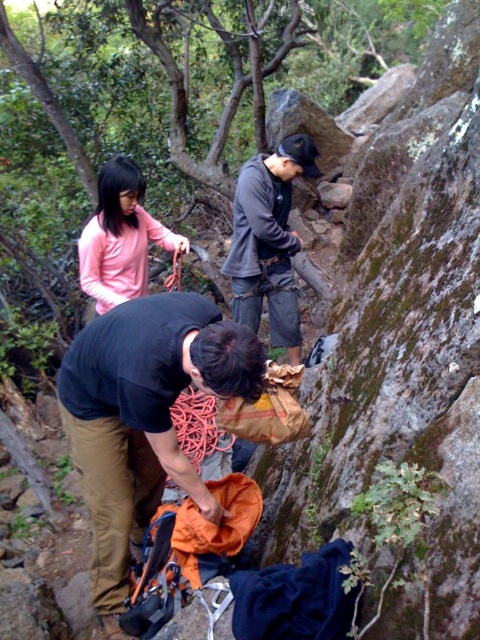
Is point (120, 561) positioned behind point (264, 227)?

That is False.

Is point (124, 464) behind point (240, 300)?

No, it is in front of (240, 300).

Where is `black fabric backpack at center`? Image resolution: width=480 pixels, height=640 pixels. black fabric backpack at center is located at coordinates (144, 419).

Does dark gray fabric climbing harness at center come in front of orange nylon rope at center?

No, it is not.

Which of these two, dark gray fabric climbing harness at center or orange nylon rope at center, stands taller?

Standing taller between the two is dark gray fabric climbing harness at center.

Between point (288, 296) and point (220, 468), which one is positioned in front?

Point (220, 468) is more forward.

You are a GUI agent. You are given a task and a screenshot of the screen. Output one action in this format:
    pyautogui.click(x=<x>, y=<y>)
    Task: Click on the dark gray fabric climbing harness at center
    
    Given the screenshot: What is the action you would take?
    pyautogui.click(x=268, y=241)

Image resolution: width=480 pixels, height=640 pixels. What do you see at coordinates (144, 419) in the screenshot?
I see `black fabric backpack at center` at bounding box center [144, 419].

Can you confirm if black fabric backpack at center is shorter than orange nylon rope at center?

Answer: Incorrect, black fabric backpack at center's height does not fall short of orange nylon rope at center's.

Identify the location of black fabric backpack at center. (144, 419).